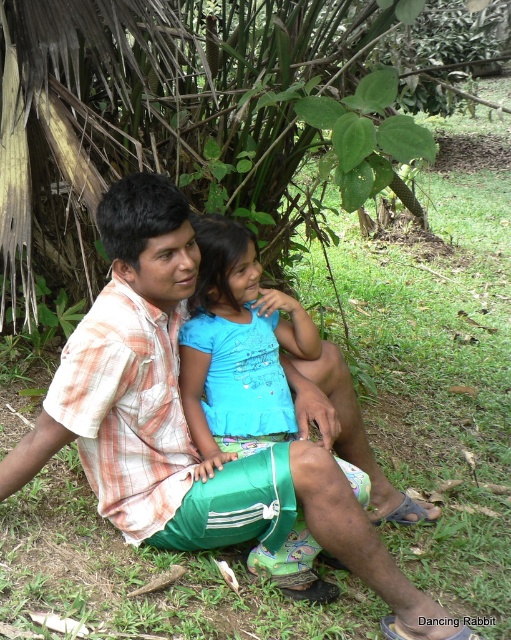
You are a photographer planning to take a portrait of two people sitting on a grassy area. You need to ensure both the plaid cotton shirt at center and the blue fabric shirt at center are fully visible in the frame. Considering their sizes, which shirt should you focus on to ensure both are in the frame without cropping?

The plaid cotton shirt at center is wider than the blue fabric shirt at center. To ensure both are fully visible in the frame without cropping, focus on centering the plaid cotton shirt at center since it takes up more space, allowing the narrower blue fabric shirt at center to fit alongside.

You are a photographer trying to capture a candid shot of both the plaid cotton shirt at center and the blue fabric shirt at center in the same frame. Given their sizes, which shirt should you focus on to ensure both are visible without cropping either?

The plaid cotton shirt at center is larger than the blue fabric shirt at center, so you should focus on framing the larger plaid cotton shirt first to ensure it fits, and the smaller blue fabric shirt at center will naturally be included in the shot.